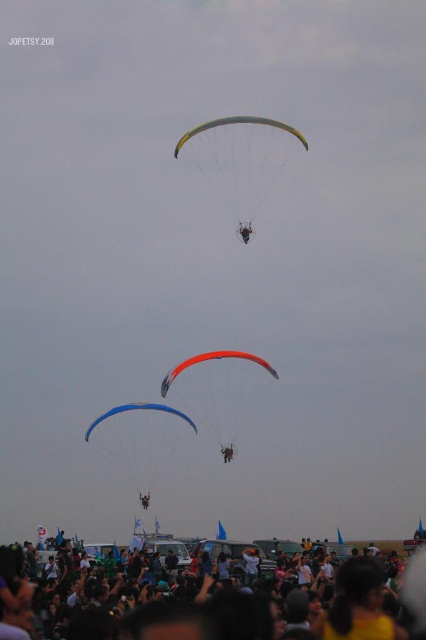
Looking at this image, you are a photographer standing at the edge of the matte black crowd at lower center. You want to take a photo of the orange matte parachute at center. Can you see it clearly without any obstructions?

The orange matte parachute at center is behind the matte black crowd at lower center, so it will be partially or fully obstructed by the crowd, making it difficult to see clearly.

You are a photographer standing in the crowd at the event. You want to take a photo of the orange matte parachute at center without the matte black crowd at lower center blocking the view. Which direction should you move to ensure the crowd is out of the frame?

Move to the left side of the orange matte parachute at center since the matte black crowd at lower center is on its right, so moving left would position the crowd out of the frame.